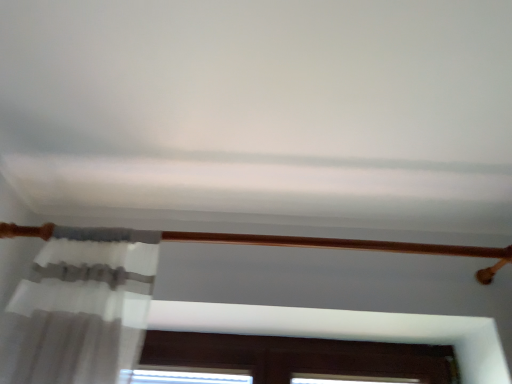
Locate an element on the screen. This screenshot has width=512, height=384. wooden pole at upper center is located at coordinates (341, 244).

Measure the distance between wooden pole at upper center and camera.

The depth of wooden pole at upper center is 1.06 meters.

Measure the distance between point (x=269, y=236) and camera.

The depth of point (x=269, y=236) is 3.62 feet.

The image size is (512, 384). Describe the element at coordinates (341, 244) in the screenshot. I see `wooden pole at upper center` at that location.

At what (x,y) coordinates should I click in order to perform the action: click on wooden pole at upper center. Please return your answer as a coordinate pair (x, y). This screenshot has height=384, width=512. Looking at the image, I should click on (341, 244).